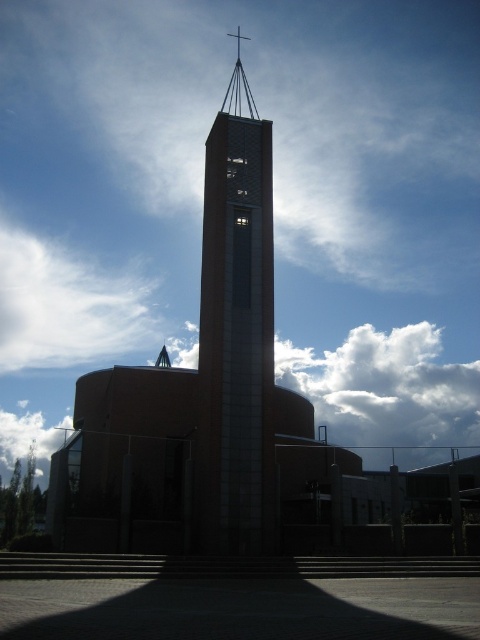
You are standing at a viewpoint 50 meters away from the smooth concrete bell tower at center. Can you safely walk towards it without needing to move any obstacles?

The smooth concrete bell tower at center and camera are 48.52 meters apart from each other. Since you are 50 meters away, you are slightly farther than the measured distance, but the difference is minimal. Assuming there are no obstacles between you and the tower, you can safely walk towards it.

You are an architect designing a new park layout. You need to place a statue exactly between the smooth concrete bell tower at center and the white fluffy cloud at lower left. Which object should be closer to the statue? Please explain based on their positions.

The smooth concrete bell tower at center is positioned on the right side of the white fluffy cloud at lower left. Therefore, the statue should be placed closer to the white fluffy cloud at lower left to maintain equal distance between both objects.

You are an architect analyzing the image of the modern church. You need to determine which object occupies more visual space in the composition. Based on the scene, which one is bigger between the smooth concrete bell tower at center and the white fluffy cloud at lower left?

The smooth concrete bell tower at center is larger in size than the white fluffy cloud at lower left, so it occupies more visual space in the composition.